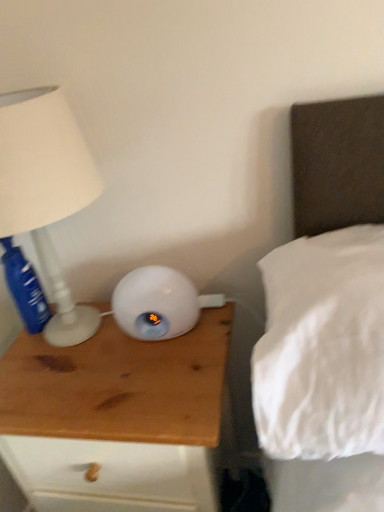
Identify the location of vacant area located to the right-hand side of blue plastic bottle at left. (88, 328).